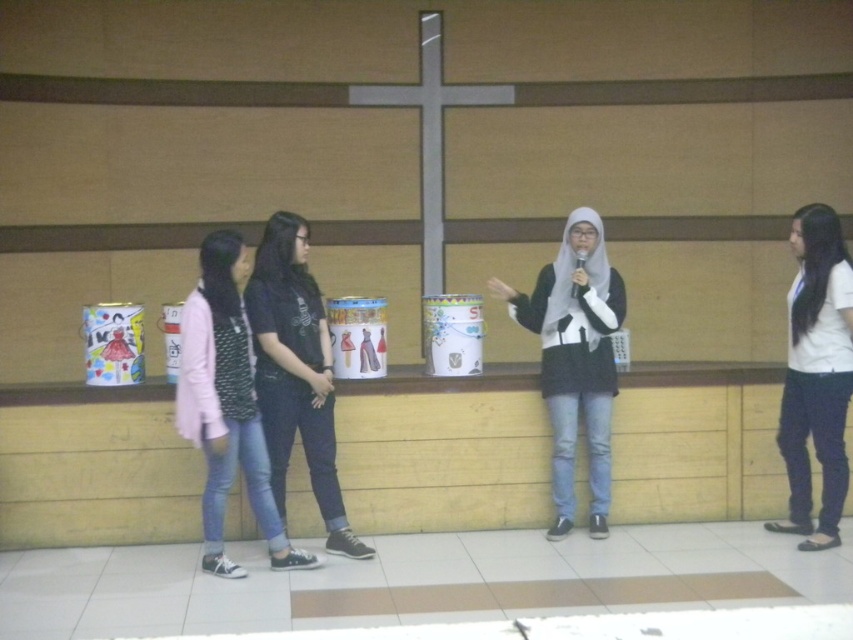
Can you confirm if matte black hijab at center is positioned to the left of dark blue jeans at center?

In fact, matte black hijab at center is to the right of dark blue jeans at center.

This screenshot has width=853, height=640. What are the coordinates of `matte black hijab at center` in the screenshot? It's located at (575, 358).

Locate an element on the screen. Image resolution: width=853 pixels, height=640 pixels. matte black hijab at center is located at coordinates (575, 358).

Does dark blue jeans at center appear over white matte shirt at right?

No.

Between point (309, 340) and point (792, 234), which one is positioned behind?

The point (792, 234) is behind.

Measure the distance between dark blue jeans at center and camera.

dark blue jeans at center and camera are 15.78 feet apart.

You are a GUI agent. You are given a task and a screenshot of the screen. Output one action in this format:
    pyautogui.click(x=<x>, y=<y>)
    Task: Click on the dark blue jeans at center
    The width and height of the screenshot is (853, 640).
    Given the screenshot: What is the action you would take?
    pyautogui.click(x=296, y=372)

Who is shorter, denim jacket at center or dark blue jeans at center?

Standing shorter between the two is denim jacket at center.

Can you confirm if denim jacket at center is positioned to the right of dark blue jeans at center?

No, denim jacket at center is not to the right of dark blue jeans at center.

Which is behind, point (241, 372) or point (350, 547)?

The point (350, 547) is behind.

Locate an element on the screen. The width and height of the screenshot is (853, 640). denim jacket at center is located at coordinates [x=225, y=404].